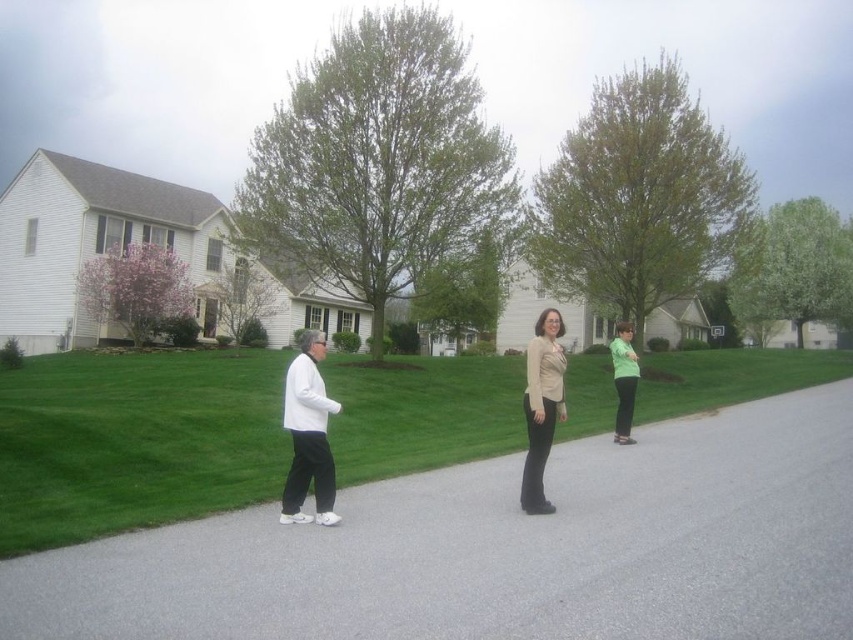
I want to click on beige fabric blouse at center, so click(x=541, y=406).

Does beige fabric blouse at center appear under matte green sweater at right?

No.

Measure the distance between point (532, 433) and camera.

21.87 feet

What are the coordinates of `beige fabric blouse at center` in the screenshot? It's located at click(541, 406).

Is green grass at center positioned before white matte jacket at center?

That is True.

Can you confirm if green grass at center is thinner than white matte jacket at center?

No.

Is point (186, 499) positioned behind point (285, 492)?

Yes.

Locate an element on the screen. The width and height of the screenshot is (853, 640). green grass at center is located at coordinates (135, 442).

Who is more distant from viewer, (322, 488) or (630, 365)?

The point (630, 365) is behind.

Which is below, white matte jacket at center or matte green sweater at right?

Positioned lower is matte green sweater at right.

Is point (338, 520) positioned behind point (611, 348)?

No, (338, 520) is closer to viewer.

This screenshot has width=853, height=640. Identify the location of white matte jacket at center. (308, 435).